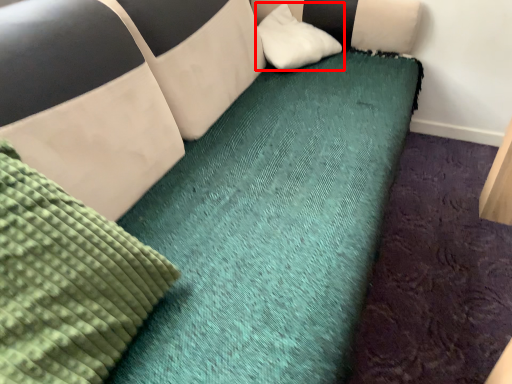
Question: From the image, what is the correct spatial relationship of pillow (annotated by the red box) in relation to mattress?

Choices:
 (A) right
 (B) left

Answer: (A)